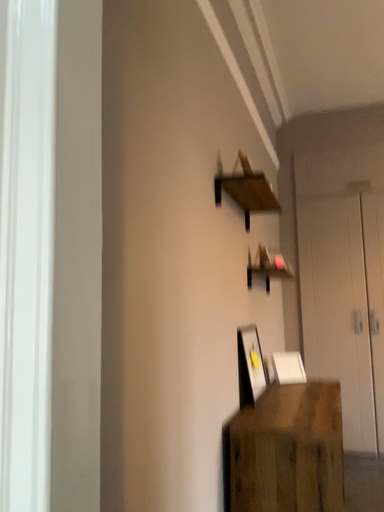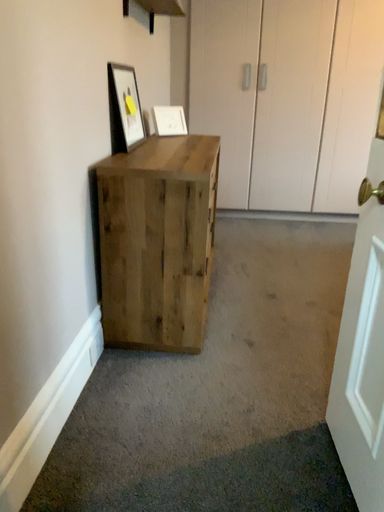
Question: How did the camera likely rotate when shooting the video?

Choices:
 (A) rotated right
 (B) rotated left

Answer: (A)